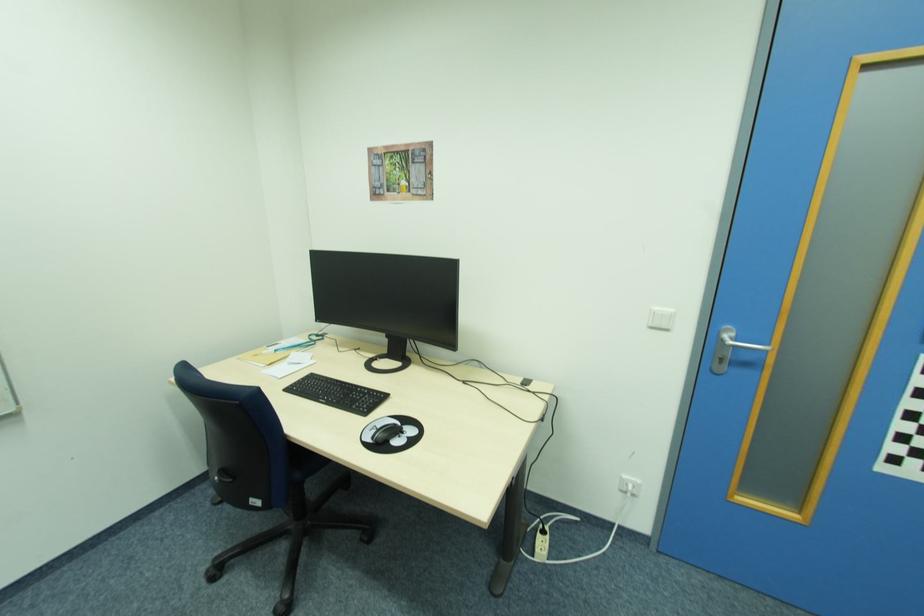
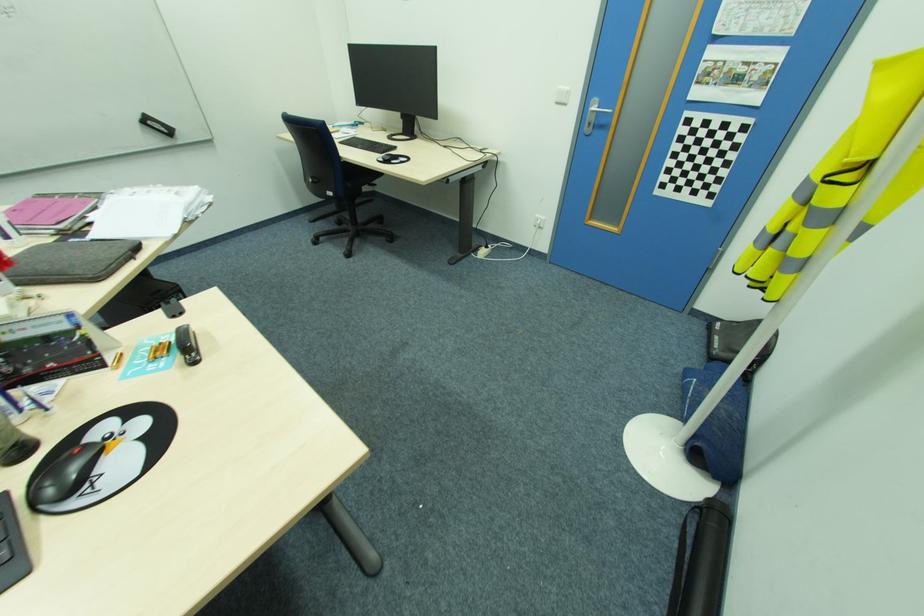
Locate, in the second image, the point that corresponds to point 737,339 in the first image.

(600, 108)